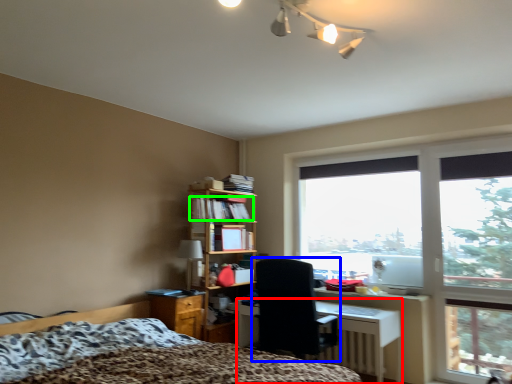
Question: Estimate the real-world distances between objects in this image. Which object is farther from desk (highlighted by a red box), chair (highlighted by a blue box) or book (highlighted by a green box)?

Choices:
 (A) chair
 (B) book

Answer: (B)